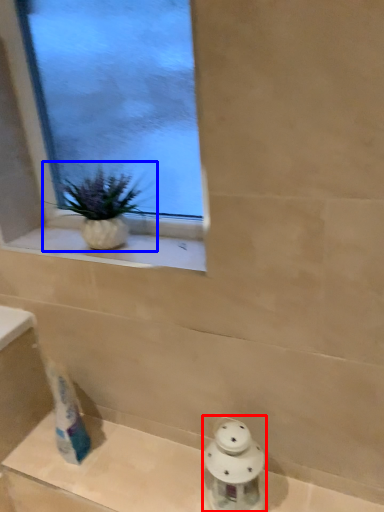
Question: Among these objects, which one is nearest to the camera, porcelain (highlighted by a red box) or houseplant (highlighted by a blue box)?

Choices:
 (A) porcelain
 (B) houseplant

Answer: (A)